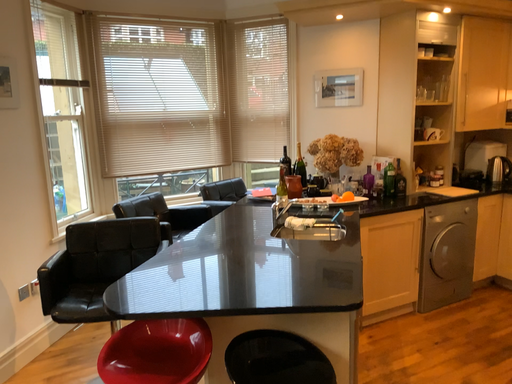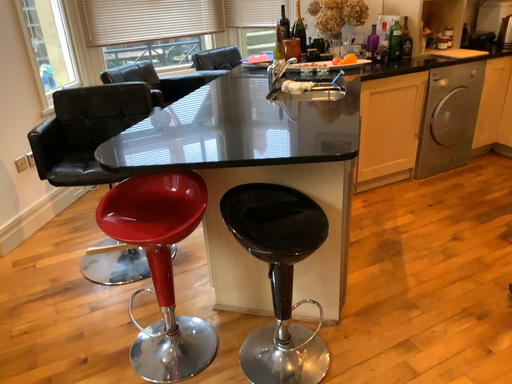
Question: How did the camera likely rotate when shooting the video?

Choices:
 (A) rotated upward
 (B) rotated downward

Answer: (B)